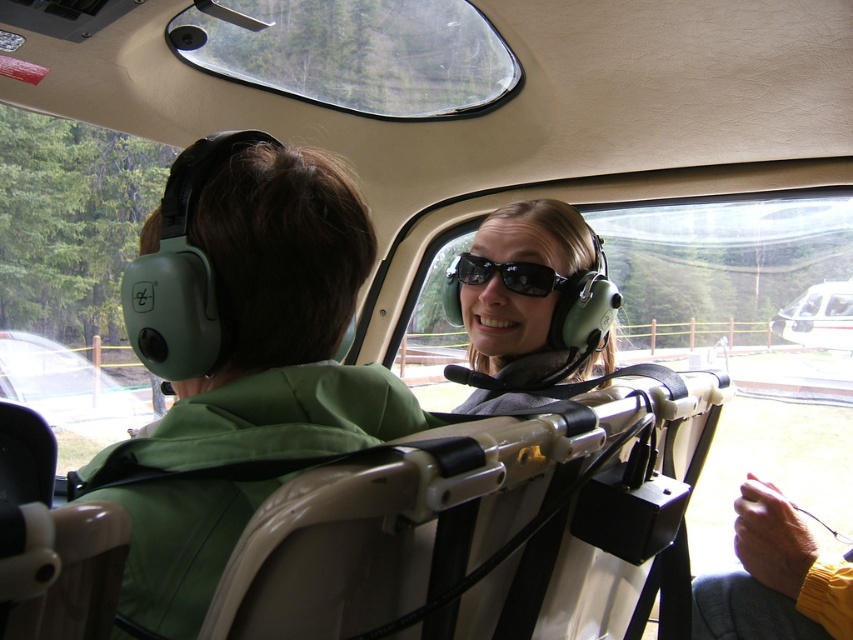
Who is more distant from viewer, (799, 333) or (547, 273)?

Point (799, 333)

How much distance is there between white glossy helicopter at center and black reflective sunglasses at center?

→ white glossy helicopter at center is 5.33 meters away from black reflective sunglasses at center.

Which is in front, point (819, 310) or point (448, 268)?

Point (448, 268)

You are a GUI agent. You are given a task and a screenshot of the screen. Output one action in this format:
    pyautogui.click(x=<x>, y=<y>)
    Task: Click on the white glossy helicopter at center
    The height and width of the screenshot is (640, 853).
    Given the screenshot: What is the action you would take?
    pyautogui.click(x=817, y=316)

Is green matte jacket at center smaller than yellow sweater at lower right?

No, green matte jacket at center is not smaller than yellow sweater at lower right.

What do you see at coordinates (241, 356) in the screenshot?
I see `green matte jacket at center` at bounding box center [241, 356].

Image resolution: width=853 pixels, height=640 pixels. In order to click on green matte jacket at center in this screenshot , I will do `click(241, 356)`.

Measure the distance from yellow sweater at lower right to black reflective sunglasses at center.

yellow sweater at lower right is 57.87 centimeters away from black reflective sunglasses at center.

Between yellow sweater at lower right and black reflective sunglasses at center, which one has less height?

Standing shorter between the two is black reflective sunglasses at center.

The width and height of the screenshot is (853, 640). Identify the location of yellow sweater at lower right. (772, 579).

In order to click on yellow sweater at lower right in this screenshot , I will do `click(772, 579)`.